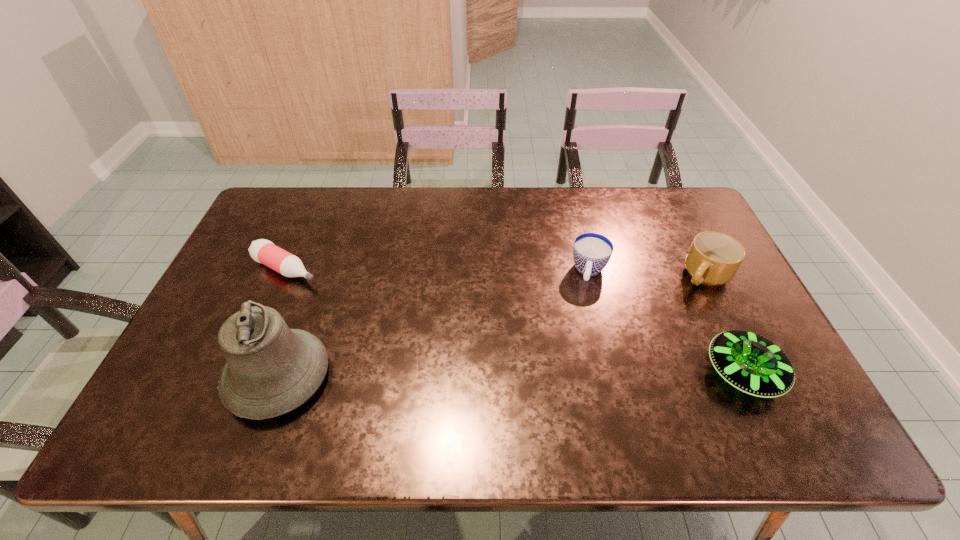
Where is `vacant spot on the desktop that is between the tallest object and the saucer and is positioned with the cap open on the bottle`? The width and height of the screenshot is (960, 540). vacant spot on the desktop that is between the tallest object and the saucer and is positioned with the cap open on the bottle is located at coordinates pos(478,375).

Where is `vacant spot on the desktop that is between the tallest object and the saucer and is positioned on the side of the cup with the handle`? vacant spot on the desktop that is between the tallest object and the saucer and is positioned on the side of the cup with the handle is located at coordinates (571, 374).

The image size is (960, 540). In order to click on vacant spot on the desktop that is between the bell and the saucer and is positioned on the side with the handle of the mug in this screenshot , I will do `click(560, 375)`.